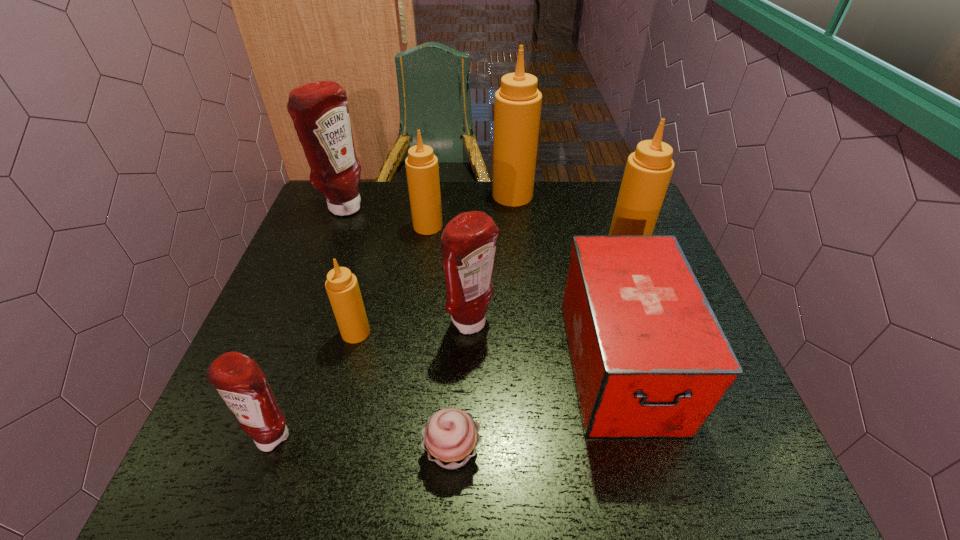
In order to click on free spot located 0.400m on the right of the rightmost red condiment in this screenshot , I will do `click(666, 324)`.

You are a GUI agent. You are given a task and a screenshot of the screen. Output one action in this format:
    pyautogui.click(x=<x>, y=<y>)
    Task: Click on the free space located 0.350m on the right of the leftmost tan condiment
    The height and width of the screenshot is (540, 960).
    Given the screenshot: What is the action you would take?
    pyautogui.click(x=522, y=333)

Where is `vacant region located 0.070m on the right of the smallest red condiment`? This screenshot has width=960, height=540. vacant region located 0.070m on the right of the smallest red condiment is located at coordinates (337, 434).

Where is `vacant area situated on the handle side of the first-aid kit`? The height and width of the screenshot is (540, 960). vacant area situated on the handle side of the first-aid kit is located at coordinates click(x=649, y=470).

Where is `vacant space situated on the right of the pink cupcake`? Image resolution: width=960 pixels, height=540 pixels. vacant space situated on the right of the pink cupcake is located at coordinates (515, 451).

Where is `condiment situated at the near edge`? This screenshot has height=540, width=960. condiment situated at the near edge is located at coordinates (241, 383).

The height and width of the screenshot is (540, 960). I want to click on cupcake present at the near edge, so click(x=450, y=437).

Identify the location of condiment present at the right edge. The image size is (960, 540). (648, 171).

Locate an element on the screen. the first-aid kit that is at the right edge is located at coordinates (650, 360).

Where is `object at the far left corner`? The height and width of the screenshot is (540, 960). object at the far left corner is located at coordinates (319, 110).